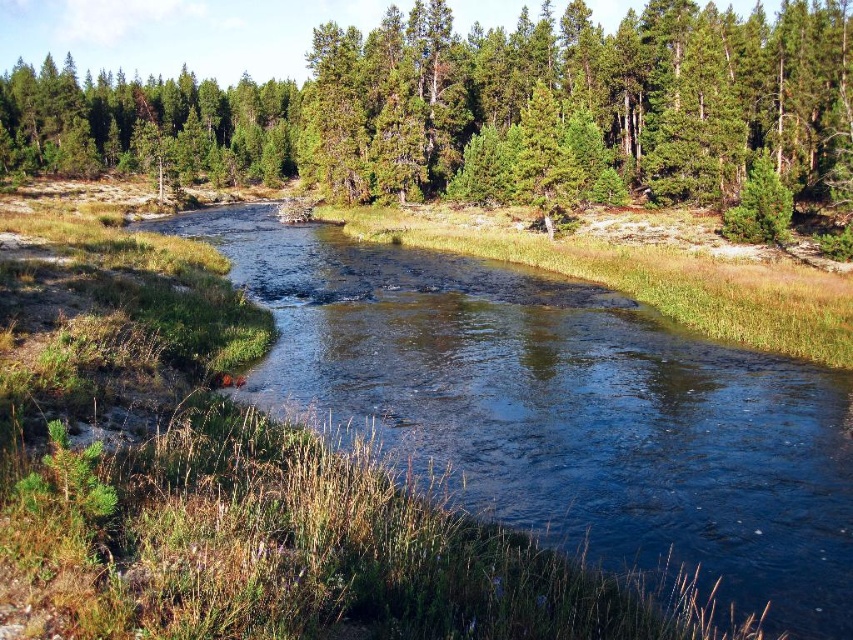
In the scene shown: You are planning to cross the river using a small boat. The boat can only carry items that are as wide as the clear water at center. Can you safely transport a log that is as wide as the green matte tree at upper left?

The clear water at center is thinner than the green matte tree at upper left, so the log would be too wide to fit within the width of the clear water at center. Therefore, you cannot safely transport the log.

You are planning to plant a new tree in this area. Considering the existing green textured trees at center and the green matte tree at upper left, which one would you choose as a reference for height if you want a shorter tree?

The green textured trees at center are not as tall as the green matte tree at upper left, so if you want a shorter tree, you should choose the green textured trees at center as a reference.